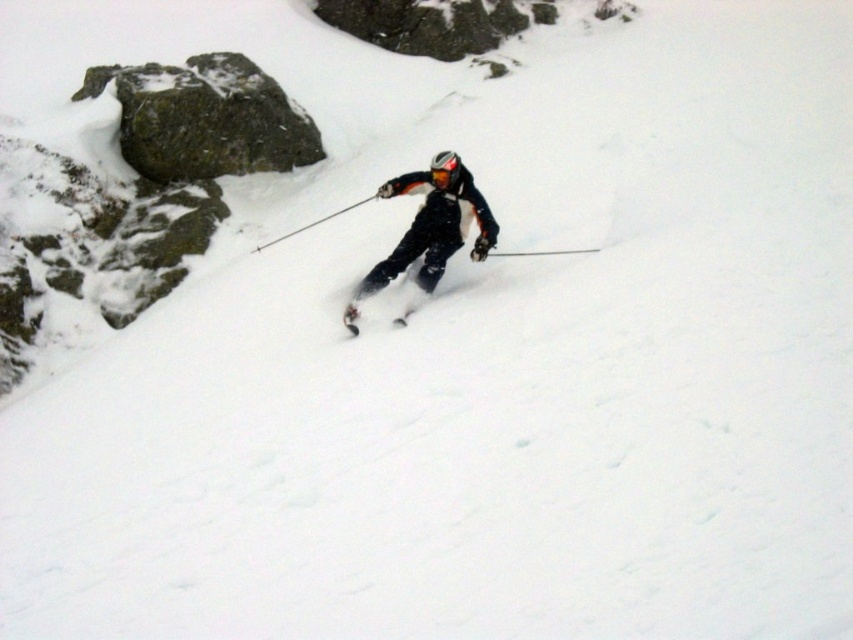
Is matte black ski at center wider than metallic ski pole at center?

Incorrect, matte black ski at center's width does not surpass metallic ski pole at center's.

Is matte black ski at center above metallic ski pole at center?

No.

Describe the element at coordinates (410, 307) in the screenshot. I see `matte black ski at center` at that location.

The image size is (853, 640). I want to click on matte black ski at center, so click(410, 307).

Who is more forward, (437, 164) or (350, 323)?

Point (350, 323)

Is matte black ski suit at center thinner than matte black ski at center?

No.

Who is more forward, (428, 188) or (357, 307)?

Point (357, 307) is in front.

Where is `matte black ski suit at center`? The width and height of the screenshot is (853, 640). matte black ski suit at center is located at coordinates (430, 227).

Does matte black ski suit at center appear on the right side of metallic ski pole at center?

Correct, you'll find matte black ski suit at center to the right of metallic ski pole at center.

Who is positioned more to the right, matte black ski suit at center or metallic ski pole at center?

From the viewer's perspective, matte black ski suit at center appears more on the right side.

Image resolution: width=853 pixels, height=640 pixels. What are the coordinates of `matte black ski suit at center` in the screenshot? It's located at pos(430,227).

The height and width of the screenshot is (640, 853). I want to click on matte black ski suit at center, so click(x=430, y=227).